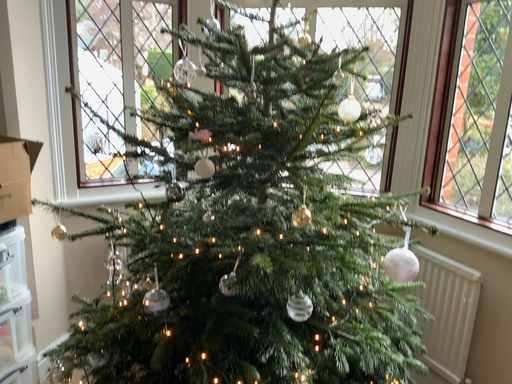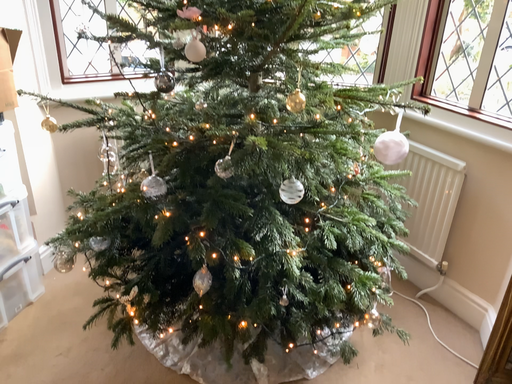
Question: Which way did the camera rotate in the video?

Choices:
 (A) rotated upward
 (B) rotated downward

Answer: (B)